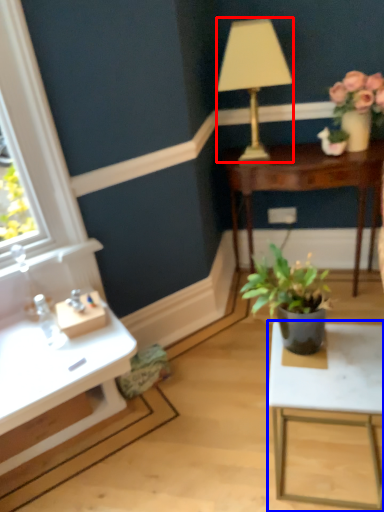
Question: Which object is further to the camera taking this photo, lamp (highlighted by a red box) or table (highlighted by a blue box)?

Choices:
 (A) lamp
 (B) table

Answer: (A)